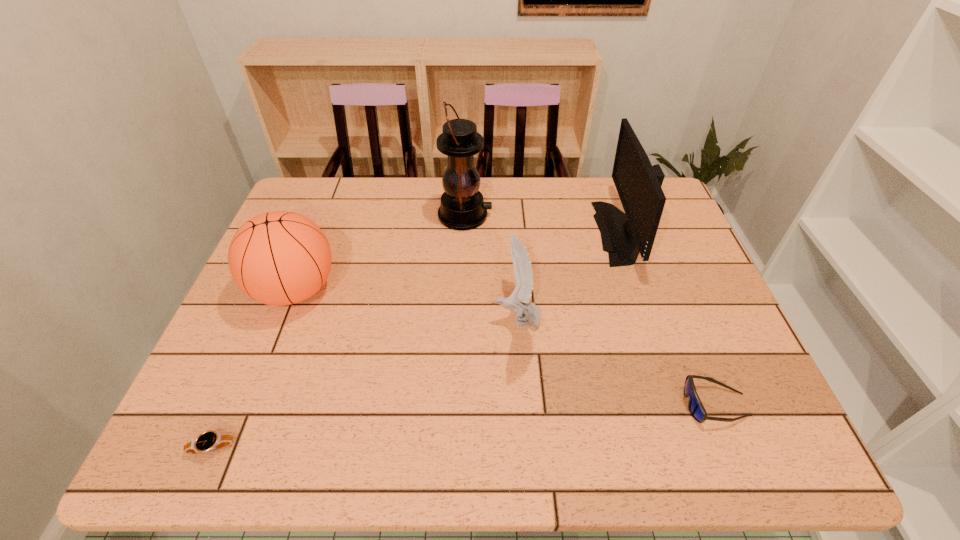
Locate an element on the screen. vacant space situated on the screen side of the second tallest object is located at coordinates (516, 233).

Identify the location of vacant region located 0.100m on the screen side of the second tallest object. Image resolution: width=960 pixels, height=540 pixels. (564, 233).

In order to click on vacant space positioned 0.190m on the back of the basketball in this screenshot , I will do `click(324, 216)`.

You are a GUI agent. You are given a task and a screenshot of the screen. Output one action in this format:
    pyautogui.click(x=<x>, y=<y>)
    Task: Click on the vacant area situated at the tip of the beak of the gull
    
    Given the screenshot: What is the action you would take?
    pyautogui.click(x=330, y=320)

The width and height of the screenshot is (960, 540). Identify the location of free space located at the tip of the beak of the gull. (392, 320).

Identify the location of free space located at the tip of the beak of the gull. The width and height of the screenshot is (960, 540). (417, 320).

Locate an element on the screen. Image resolution: width=960 pixels, height=540 pixels. free location located on the front-facing side of the sunglasses is located at coordinates (510, 404).

Locate an element on the screen. The image size is (960, 540). blank space located 0.310m on the front-facing side of the sunglasses is located at coordinates (534, 404).

Identify the location of free spot located 0.380m on the front-facing side of the sunglasses. (500, 404).

You are a GUI agent. You are given a task and a screenshot of the screen. Output one action in this format:
    pyautogui.click(x=<x>, y=<y>)
    Task: Click on the vacant space situated 0.120m on the right of the shortest object
    This screenshot has height=540, width=960.
    Given the screenshot: What is the action you would take?
    pyautogui.click(x=297, y=448)